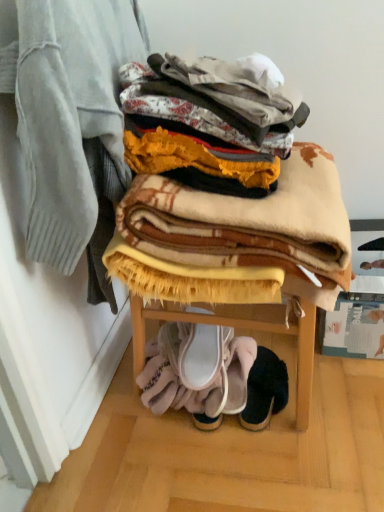
Question: Can you confirm if white fabric slipper at lower center, positioned as the third footwear in right-to-left order, is taller than beige woolen blanket at center, which appears as the 2th blanket when viewed from the left?

Choices:
 (A) no
 (B) yes

Answer: (A)

Question: From the image's perspective, is white fabric slipper at lower center, the first footwear from the left, on top of beige woolen blanket at center, which appears as the 2th blanket when viewed from the left?

Choices:
 (A) yes
 (B) no

Answer: (B)

Question: Is white fabric slipper at lower center, positioned as the third footwear in right-to-left order, thinner than beige woolen blanket at center, which appears as the 2th blanket when viewed from the left?

Choices:
 (A) yes
 (B) no

Answer: (A)

Question: Is white fabric slipper at lower center, positioned as the third footwear in right-to-left order, further to camera compared to beige woolen blanket at center, which appears as the 2th blanket when viewed from the left?

Choices:
 (A) yes
 (B) no

Answer: (A)

Question: From a real-world perspective, is white fabric slipper at lower center, positioned as the third footwear in right-to-left order, physically below beige woolen blanket at center, the first blanket in the right-to-left sequence?

Choices:
 (A) yes
 (B) no

Answer: (A)

Question: Considering their positions, is plaid wool blanket at upper center, arranged as the first blanket when viewed from the left, located in front of or behind white fabric slipper at lower center, acting as the second footwear starting from the left?

Choices:
 (A) front
 (B) behind

Answer: (A)

Question: Is point (72, 95) positioned closer to the camera than point (235, 400)?

Choices:
 (A) farther
 (B) closer

Answer: (B)

Question: From the image's perspective, relative to white fabric slipper at lower center, acting as the second footwear starting from the left, is plaid wool blanket at upper center, arranged as the first blanket when viewed from the left, above or below?

Choices:
 (A) below
 (B) above

Answer: (B)

Question: Is plaid wool blanket at upper center, arranged as the first blanket when viewed from the left, wider or thinner than white fabric slipper at lower center, acting as the second footwear starting from the left?

Choices:
 (A) wide
 (B) thin

Answer: (B)

Question: Considering the positions of plaid wool blanket at upper center, arranged as the first blanket when viewed from the left, and black suede slipper at lower center, the 3th footwear positioned from the left, in the image, is plaid wool blanket at upper center, arranged as the first blanket when viewed from the left, bigger or smaller than black suede slipper at lower center, the 3th footwear positioned from the left,?

Choices:
 (A) small
 (B) big

Answer: (B)

Question: From the image's perspective, relative to black suede slipper at lower center, the 3th footwear positioned from the left, is plaid wool blanket at upper center, which is counted as the second blanket, starting from the right, above or below?

Choices:
 (A) above
 (B) below

Answer: (A)

Question: Is plaid wool blanket at upper center, which is counted as the second blanket, starting from the right, wider or thinner than black suede slipper at lower center, marked as the 1th footwear in a right-to-left arrangement?

Choices:
 (A) wide
 (B) thin

Answer: (B)

Question: Considering their positions, is plaid wool blanket at upper center, which is counted as the second blanket, starting from the right, located in front of or behind black suede slipper at lower center, marked as the 1th footwear in a right-to-left arrangement?

Choices:
 (A) behind
 (B) front

Answer: (B)

Question: Considering the positions of white fabric slipper at lower center, positioned as the third footwear in right-to-left order, and black suede slipper at lower center, the 3th footwear positioned from the left, in the image, is white fabric slipper at lower center, positioned as the third footwear in right-to-left order, taller or shorter than black suede slipper at lower center, the 3th footwear positioned from the left,?

Choices:
 (A) short
 (B) tall

Answer: (B)

Question: In the image, is white fabric slipper at lower center, the first footwear from the left, positioned in front of or behind black suede slipper at lower center, marked as the 1th footwear in a right-to-left arrangement?

Choices:
 (A) front
 (B) behind

Answer: (A)